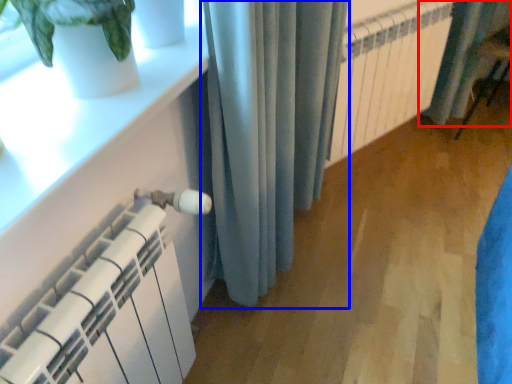
Question: Which object appears farthest to the camera in this image, curtain (highlighted by a red box) or curtain (highlighted by a blue box)?

Choices:
 (A) curtain
 (B) curtain

Answer: (A)